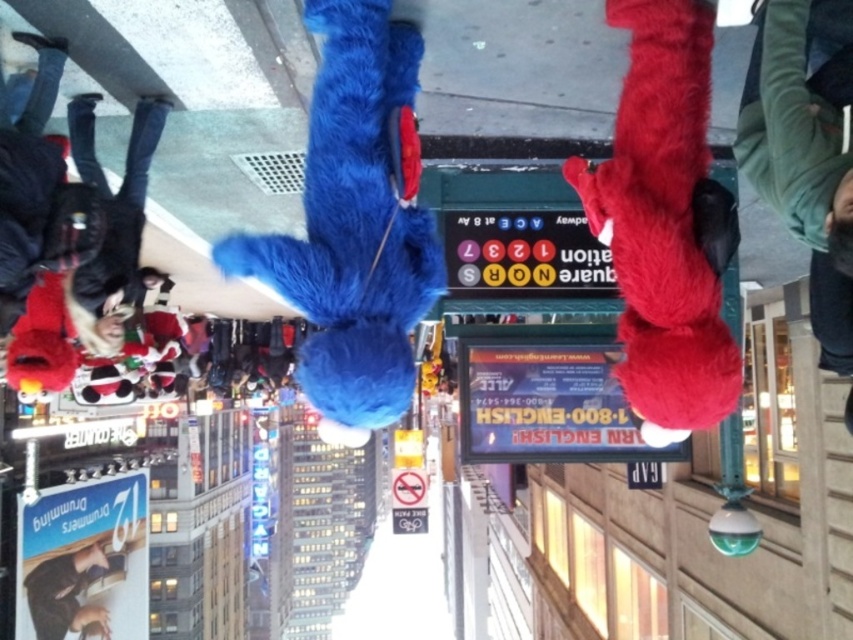
Is point (848, 422) positioned before point (67, 554)?

Yes, it is in front of point (67, 554).

Which is below, green fuzzy sweater at upper right or smooth black phone at lower left?

Positioned lower is smooth black phone at lower left.

Where is `green fuzzy sweater at upper right`? The width and height of the screenshot is (853, 640). green fuzzy sweater at upper right is located at coordinates (805, 148).

Identify the location of green fuzzy sweater at upper right. The height and width of the screenshot is (640, 853). (805, 148).

Which is more to the left, fuzzy blue plush at center or green fuzzy sweater at upper right?

Positioned to the left is fuzzy blue plush at center.

Who is more forward, (367, 241) or (811, 252)?

Point (367, 241) is more forward.

This screenshot has height=640, width=853. What do you see at coordinates (352, 224) in the screenshot?
I see `fuzzy blue plush at center` at bounding box center [352, 224].

This screenshot has width=853, height=640. Find the location of `fuzzy blue plush at center`. fuzzy blue plush at center is located at coordinates (352, 224).

Is point (416, 291) positioned behind point (90, 621)?

No.

Which of these two, fuzzy blue plush at center or smooth black phone at lower left, stands shorter?

fuzzy blue plush at center is shorter.

Which is behind, point (386, 148) or point (79, 589)?

Point (79, 589)

Where is `fuzzy blue plush at center`? This screenshot has width=853, height=640. fuzzy blue plush at center is located at coordinates (352, 224).